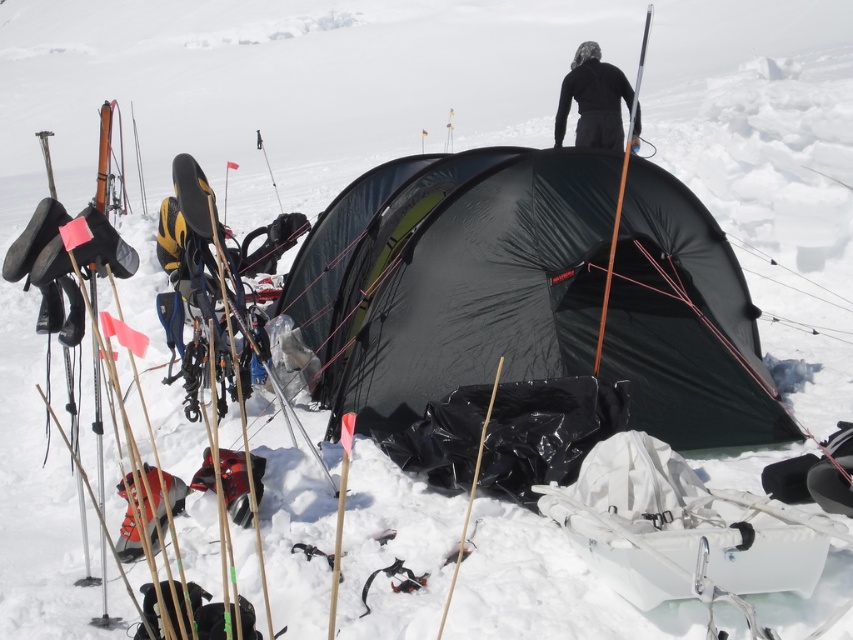
Between black tarpaulin tent at center and black matte jacket at upper center, which one appears on the right side from the viewer's perspective?

black matte jacket at upper center is more to the right.

This screenshot has height=640, width=853. Describe the element at coordinates (453, 276) in the screenshot. I see `black tarpaulin tent at center` at that location.

Where is `black tarpaulin tent at center`? The height and width of the screenshot is (640, 853). black tarpaulin tent at center is located at coordinates [453, 276].